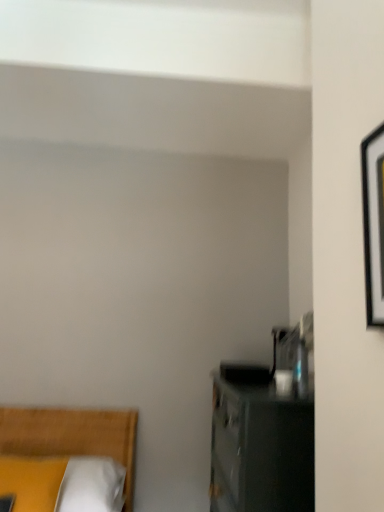
Question: Can you confirm if yellow fabric pillow at lower left is thinner than black matte picture frame at right?

Choices:
 (A) yes
 (B) no

Answer: (B)

Question: Does yellow fabric pillow at lower left contain black matte picture frame at right?

Choices:
 (A) no
 (B) yes

Answer: (A)

Question: Could you tell me if yellow fabric pillow at lower left is turned towards black matte picture frame at right?

Choices:
 (A) yes
 (B) no

Answer: (B)

Question: Can you confirm if yellow fabric pillow at lower left is positioned to the left of black matte picture frame at right?

Choices:
 (A) no
 (B) yes

Answer: (B)

Question: Can you confirm if yellow fabric pillow at lower left is taller than black matte picture frame at right?

Choices:
 (A) no
 (B) yes

Answer: (A)

Question: From their relative heights in the image, would you say yellow fabric bed at lower left is taller or shorter than yellow fabric pillow at lower left?

Choices:
 (A) tall
 (B) short

Answer: (A)

Question: From a real-world perspective, is yellow fabric bed at lower left physically located above or below yellow fabric pillow at lower left?

Choices:
 (A) above
 (B) below

Answer: (B)

Question: Based on their positions, is yellow fabric bed at lower left located to the left or right of yellow fabric pillow at lower left?

Choices:
 (A) right
 (B) left

Answer: (A)

Question: Is yellow fabric bed at lower left bigger or smaller than yellow fabric pillow at lower left?

Choices:
 (A) small
 (B) big

Answer: (B)

Question: From a real-world perspective, is yellow fabric pillow at lower left physically located above or below yellow fabric bed at lower left?

Choices:
 (A) below
 (B) above

Answer: (B)

Question: Is yellow fabric pillow at lower left inside the boundaries of yellow fabric bed at lower left, or outside?

Choices:
 (A) inside
 (B) outside

Answer: (A)

Question: From the image's perspective, relative to yellow fabric bed at lower left, is yellow fabric pillow at lower left above or below?

Choices:
 (A) below
 (B) above

Answer: (B)

Question: In the image, is yellow fabric pillow at lower left positioned in front of or behind yellow fabric bed at lower left?

Choices:
 (A) front
 (B) behind

Answer: (A)

Question: Is yellow fabric pillow at lower left taller or shorter than black matte picture frame at right?

Choices:
 (A) tall
 (B) short

Answer: (B)

Question: From a real-world perspective, is yellow fabric pillow at lower left positioned above or below black matte picture frame at right?

Choices:
 (A) below
 (B) above

Answer: (A)